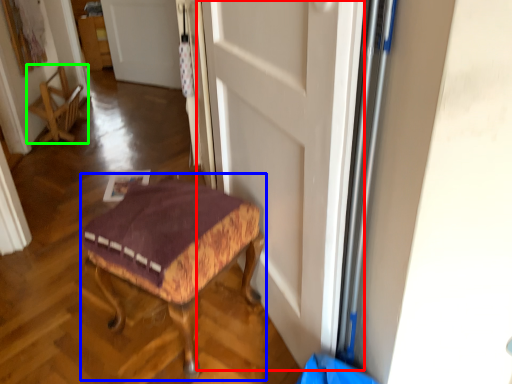
Question: Which object is the closest to the door (highlighted by a red box)? Choose among these: furniture (highlighted by a blue box) or chair (highlighted by a green box).

Choices:
 (A) furniture
 (B) chair

Answer: (A)